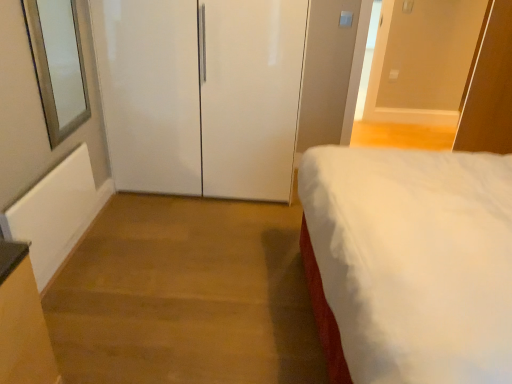
Describe the element at coordinates (422, 60) in the screenshot. I see `white glossy door at upper right, the first door when ordered from right to left` at that location.

Where is `white glossy door at center, the 1th door positioned from the left`? This screenshot has width=512, height=384. white glossy door at center, the 1th door positioned from the left is located at coordinates (201, 94).

Based on the photo, which object is closer to the camera taking this photo, white glossy door at upper right, the 2th door viewed from the left, or clear glass window at left?

clear glass window at left is more forward.

Is point (384, 108) behind point (58, 77)?

Yes, it is.

Between white glossy door at upper right, the first door when ordered from right to left, and clear glass window at left, which one appears on the right side from the viewer's perspective?

white glossy door at upper right, the first door when ordered from right to left.

Does white glossy door at upper right, the 2th door viewed from the left, have a lesser height compared to white glossy door at center, the 1th door positioned from the left?

Yes, white glossy door at upper right, the 2th door viewed from the left, is shorter than white glossy door at center, the 1th door positioned from the left.

Can you tell me how much white glossy door at upper right, the first door when ordered from right to left, and white glossy door at center, which is the second door in right-to-left order, differ in facing direction?

1.06 degrees separate the facing orientations of white glossy door at upper right, the first door when ordered from right to left, and white glossy door at center, which is the second door in right-to-left order.

Is the position of white glossy door at upper right, the first door when ordered from right to left, more distant than that of white glossy door at center, which is the second door in right-to-left order?

Yes, white glossy door at upper right, the first door when ordered from right to left, is behind white glossy door at center, which is the second door in right-to-left order.

Is white glossy door at center, the 1th door positioned from the left, behind white glossy door at upper right, the 2th door viewed from the left?

No, it is not.

In the scene shown: Does white glossy door at center, the 1th door positioned from the left, have a smaller size compared to white glossy door at upper right, the 2th door viewed from the left?

Incorrect, white glossy door at center, the 1th door positioned from the left, is not smaller in size than white glossy door at upper right, the 2th door viewed from the left.

Looking at this image, could you measure the distance between white glossy door at center, the 1th door positioned from the left, and white glossy door at upper right, the 2th door viewed from the left?

They are 2.28 meters apart.

From a real-world perspective, who is located higher, white glossy door at center, the 1th door positioned from the left, or white glossy door at upper right, the 2th door viewed from the left?

In real-world perspective, white glossy door at upper right, the 2th door viewed from the left, is above.

Is clear glass window at left bigger than white glossy door at upper right, the 2th door viewed from the left?

Actually, clear glass window at left might be smaller than white glossy door at upper right, the 2th door viewed from the left.

Is clear glass window at left turned away from white glossy door at upper right, the 2th door viewed from the left?

No, white glossy door at upper right, the 2th door viewed from the left, is not at the back of clear glass window at left.

Would you say clear glass window at left is inside or outside white glossy door at upper right, the first door when ordered from right to left?

clear glass window at left is spatially situated outside white glossy door at upper right, the first door when ordered from right to left.

From their relative heights in the image, would you say clear glass window at left is taller or shorter than white glossy door at upper right, the first door when ordered from right to left?

clear glass window at left is shorter than white glossy door at upper right, the first door when ordered from right to left.

Choose the correct answer: Is white soft bed at right inside clear glass window at left or outside it?

white soft bed at right is not enclosed by clear glass window at left.

Is white soft bed at right looking in the opposite direction of clear glass window at left?

No, white soft bed at right is not facing away from clear glass window at left.

Identify the location of bed below the clear glass window at left (from the image's perspective). tap(414, 260).

Considering the sizes of white glossy door at upper right, the 2th door viewed from the left, and white soft bed at right in the image, is white glossy door at upper right, the 2th door viewed from the left, taller or shorter than white soft bed at right?

In the image, white glossy door at upper right, the 2th door viewed from the left, appears to be shorter than white soft bed at right.

Is white soft bed at right surrounded by white glossy door at upper right, the first door when ordered from right to left?

That's incorrect, white soft bed at right is not inside white glossy door at upper right, the first door when ordered from right to left.

From a real-world perspective, is white glossy door at upper right, the first door when ordered from right to left, over white soft bed at right?

Yes, from a real-world perspective, white glossy door at upper right, the first door when ordered from right to left, is on top of white soft bed at right.

Which of these two, white soft bed at right or white glossy door at center, the 1th door positioned from the left, is bigger?

Bigger between the two is white soft bed at right.

From a real-world perspective, who is located higher, white soft bed at right or white glossy door at center, which is the second door in right-to-left order?

In real-world perspective, white soft bed at right is above.

Considering the relative sizes of white soft bed at right and white glossy door at center, the 1th door positioned from the left, in the image provided, is white soft bed at right taller than white glossy door at center, the 1th door positioned from the left,?

Yes, white soft bed at right is taller than white glossy door at center, the 1th door positioned from the left.

Does point (426, 182) appear closer or farther from the camera than point (257, 192)?

Clearly, point (426, 182) is closer to the camera than point (257, 192).

This screenshot has width=512, height=384. I want to click on the 2nd door counting from the right side of the clear glass window at left, so click(x=422, y=60).

Locate an element on the screen. door below the white glossy door at upper right, the first door when ordered from right to left (from the image's perspective) is located at coordinates (201, 94).

Based on their spatial positions, is white soft bed at right or white glossy door at upper right, the first door when ordered from right to left, further from white glossy door at center, the 1th door positioned from the left?

Among the two, white glossy door at upper right, the first door when ordered from right to left, is located further to white glossy door at center, the 1th door positioned from the left.

From the image, which object appears to be nearer to white soft bed at right, white glossy door at center, which is the second door in right-to-left order, or white glossy door at upper right, the first door when ordered from right to left?

white glossy door at center, which is the second door in right-to-left order, is closer to white soft bed at right.

Which object lies further to the anchor point white glossy door at upper right, the first door when ordered from right to left, white glossy door at center, which is the second door in right-to-left order, or white soft bed at right?

white soft bed at right.

Considering their positions, is white glossy door at upper right, the first door when ordered from right to left, positioned closer to white soft bed at right than clear glass window at left?

clear glass window at left is closer to white soft bed at right.

When comparing their distances from clear glass window at left, does white glossy door at upper right, the first door when ordered from right to left, or white glossy door at center, which is the second door in right-to-left order, seem closer?

white glossy door at center, which is the second door in right-to-left order, lies closer to clear glass window at left than the other object.

When comparing their distances from white soft bed at right, does white glossy door at upper right, the first door when ordered from right to left, or white glossy door at center, the 1th door positioned from the left, seem closer?

Among the two, white glossy door at center, the 1th door positioned from the left, is located nearer to white soft bed at right.

Which object lies further to the anchor point white soft bed at right, clear glass window at left or white glossy door at center, which is the second door in right-to-left order?

Among the two, clear glass window at left is located further to white soft bed at right.

Which object lies further to the anchor point clear glass window at left, white soft bed at right or white glossy door at center, which is the second door in right-to-left order?

Among the two, white soft bed at right is located further to clear glass window at left.

The image size is (512, 384). I want to click on door located between white soft bed at right and white glossy door at upper right, the first door when ordered from right to left, in the depth direction, so click(x=201, y=94).

Where is `window screen between white soft bed at right and white glossy door at upper right, the first door when ordered from right to left, from front to back`? This screenshot has height=384, width=512. window screen between white soft bed at right and white glossy door at upper right, the first door when ordered from right to left, from front to back is located at coordinates (58, 65).

At what (x,y) coordinates should I click in order to perform the action: click on door situated between clear glass window at left and white glossy door at upper right, the 2th door viewed from the left, from left to right. Please return your answer as a coordinate pair (x, y). Looking at the image, I should click on (201, 94).

Where is `window screen between white soft bed at right and white glossy door at center, which is the second door in right-to-left order, from front to back`? The width and height of the screenshot is (512, 384). window screen between white soft bed at right and white glossy door at center, which is the second door in right-to-left order, from front to back is located at coordinates pyautogui.click(x=58, y=65).